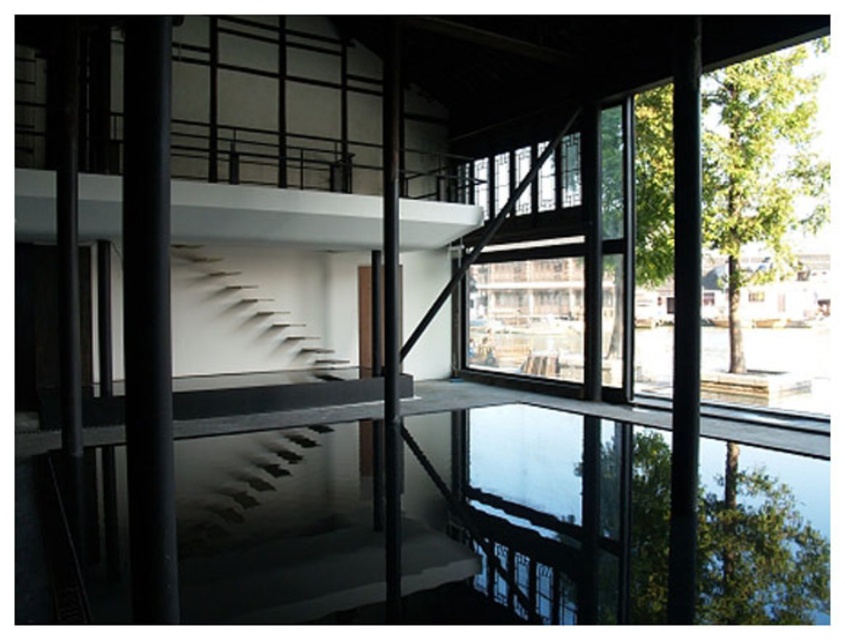
You are standing in the modern interior space described. You notice two points marked in the scene. The first point is at coordinates point (328, 515) and the second is at point (504, 177). Which point is nearer to you?

Point (328, 515) is closer to the viewer than point (504, 177).

You are standing in the modern interior space and want to walk towards the clear glass window at center. Which direction should you move relative to the white matte stairs at center?

To reach the clear glass window at center from the white matte stairs at center, you should move to the right since the white matte stairs at center is located to the left of the clear glass window at center.

In the scene shown: You are planning to install a new transparent glass pool at center in the modern interior space. The current clear glass window at center is already present. Considering the sizes mentioned, which object would require more space in the area?

The clear glass window at center requires more space because it is larger than the transparent glass pool at center.